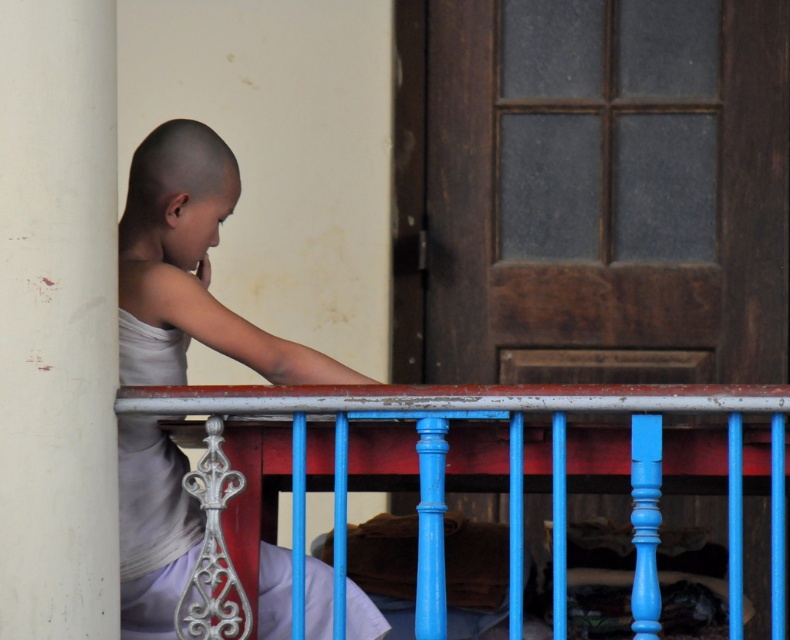
Does white matte pillar at left appear under white matte shirt at left?

No, white matte pillar at left is not below white matte shirt at left.

Can you confirm if white matte pillar at left is positioned above white matte shirt at left?

Yes, white matte pillar at left is above white matte shirt at left.

Who is more distant from viewer, (x=91, y=364) or (x=134, y=163)?

The point (x=134, y=163) is behind.

Locate an element on the screen. The image size is (790, 640). white matte pillar at left is located at coordinates (57, 317).

Which is above, blue painted wood balustrade at center or white matte shirt at left?

white matte shirt at left

Based on the photo, can you confirm if blue painted wood balustrade at center is positioned to the right of white matte shirt at left?

Correct, you'll find blue painted wood balustrade at center to the right of white matte shirt at left.

This screenshot has height=640, width=790. Describe the element at coordinates (471, 470) in the screenshot. I see `blue painted wood balustrade at center` at that location.

Identify the location of blue painted wood balustrade at center. (471, 470).

Between blue painted wood balustrade at center and white matte pillar at left, which one is positioned lower?

blue painted wood balustrade at center is below.

Who is more forward, [245,573] or [76,580]?

Point [76,580] is more forward.

Who is more forward, [386,468] or [47,570]?

Positioned in front is point [47,570].

Find the location of `blue painted wood balustrade at center`. blue painted wood balustrade at center is located at coordinates (471, 470).